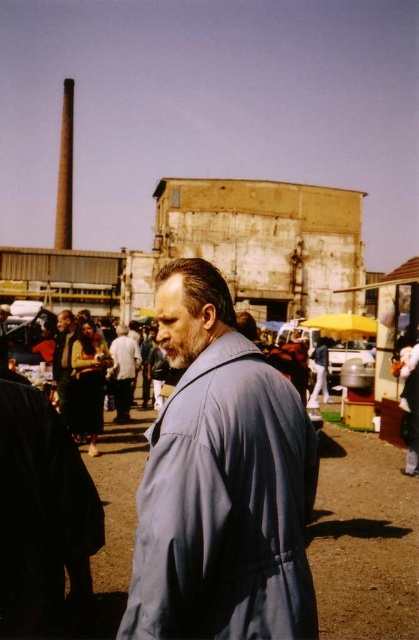
Question: Considering the relative positions of blue fabric coat at center and black matte robe at center in the image provided, where is blue fabric coat at center located with respect to black matte robe at center?

Choices:
 (A) above
 (B) below

Answer: (A)

Question: Can you confirm if blue fabric coat at center is smaller than black matte robe at center?

Choices:
 (A) yes
 (B) no

Answer: (B)

Question: Which point appears closest to the camera in this image?

Choices:
 (A) (52, 376)
 (B) (181, 492)
 (C) (35, 449)
 (D) (118, 348)

Answer: (B)

Question: Which point is farther to the camera?

Choices:
 (A) (142, 518)
 (B) (31, 394)

Answer: (B)

Question: Which point is farther to the camera?

Choices:
 (A) light brown leather jacket at center
 (B) matte black jacket at lower left
 (C) blue fabric coat at center

Answer: (A)

Question: Does blue fabric coat at center appear on the right side of black matte robe at center?

Choices:
 (A) yes
 (B) no

Answer: (A)